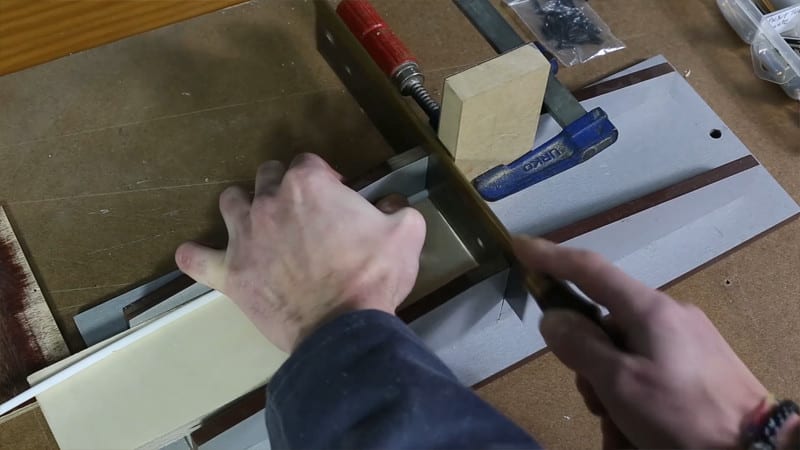
Identify the location of table. (62, 39).